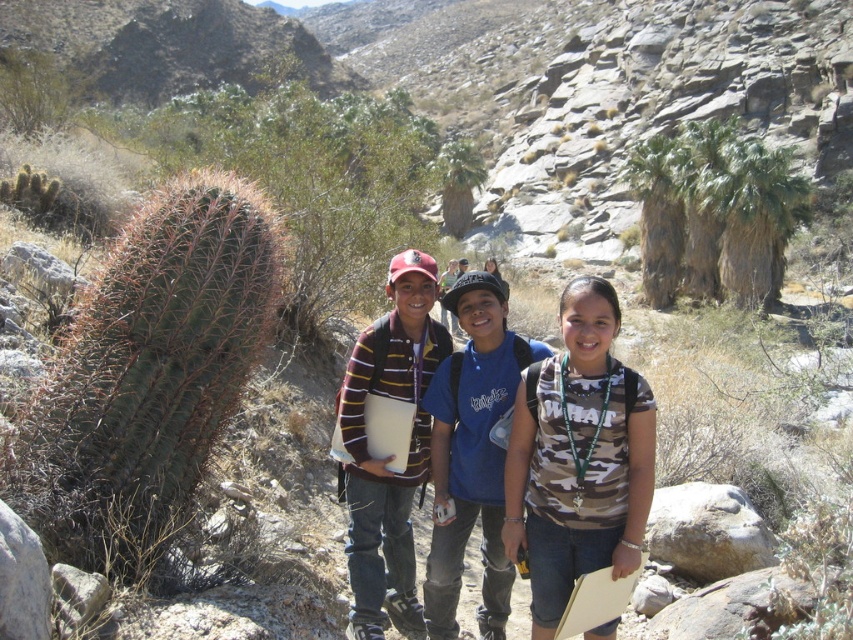
You are a photographer trying to capture a group photo of the camouflage fabric shirt at center and the camo fabric shirt at center. Since you want to ensure both are clearly visible, which one should you focus on first to account for their sizes?

The camouflage fabric shirt at center is bigger than the camo fabric shirt at center, so you should focus on the camouflage fabric shirt at center first to ensure it is in clear view before adjusting for the smaller one.

You are a photographer positioned at the origin point of the coordinate system. You want to take a photo of the camouflage fabric shirt at center. What are the coordinates where you should aim your camera?

The camouflage fabric shirt at center is located at coordinates point [430,440], so you should aim your camera at those coordinates to capture it.